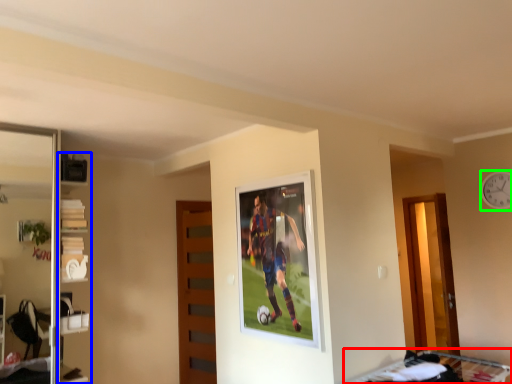
Question: Which object is positioned closest to bunk bed (highlighted by a red box)? Select from shelf (highlighted by a blue box) and clock (highlighted by a green box).

Choices:
 (A) shelf
 (B) clock

Answer: (B)